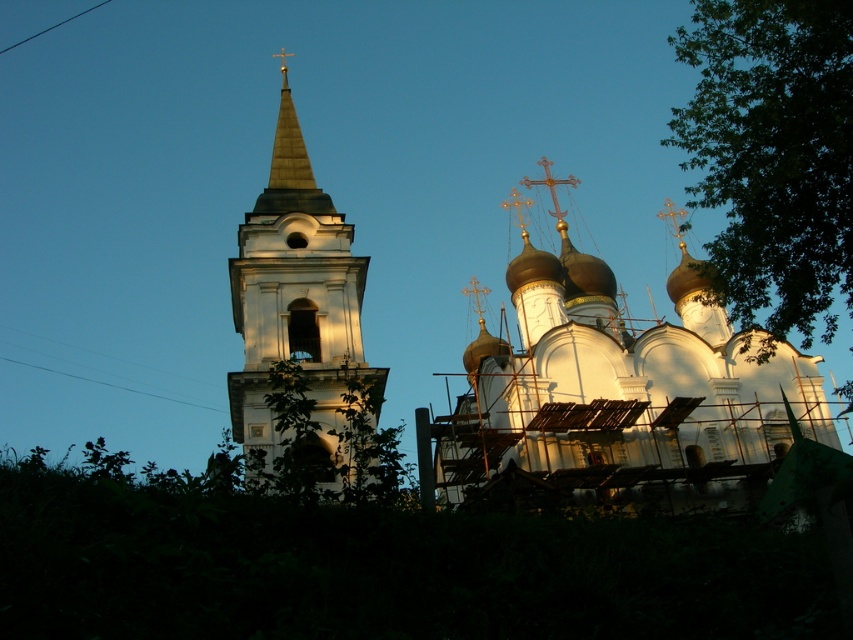
Does white textured dome at center appear over green leafy tree at upper right?

No, white textured dome at center is not above green leafy tree at upper right.

Which of these two, white textured dome at center or green leafy tree at upper right, stands shorter?

white textured dome at center is shorter.

Is point (706, 436) positioned behind point (763, 308)?

No, it is in front of (763, 308).

Where is `white textured dome at center`? This screenshot has width=853, height=640. white textured dome at center is located at coordinates (616, 394).

Can you confirm if white textured dome at center is positioned below white stone bell tower at center?

Indeed, white textured dome at center is positioned under white stone bell tower at center.

Does white textured dome at center come behind white stone bell tower at center?

Yes, white textured dome at center is behind white stone bell tower at center.

Is point (521, 269) positioned behind point (253, 410)?

Yes, it is.

Identify the location of white textured dome at center. Image resolution: width=853 pixels, height=640 pixels. (616, 394).

Between green leafy tree at upper right and white stone bell tower at center, which one is positioned lower?

white stone bell tower at center is below.

Can you confirm if green leafy tree at upper right is shorter than white stone bell tower at center?

In fact, green leafy tree at upper right may be taller than white stone bell tower at center.

The image size is (853, 640). Find the location of `green leafy tree at upper right`. green leafy tree at upper right is located at coordinates (772, 157).